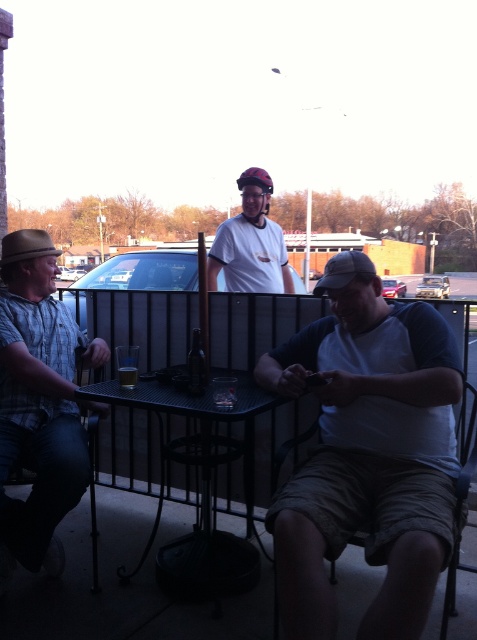
You are trying to determine if the white cotton shirt at center can fully cover the matte white helmet at center. Based on their sizes, is this possible?

The white cotton shirt at center is wider than the matte white helmet at center, so it is possible for the white cotton shirt at center to fully cover the matte white helmet at center.

In the scene shown: You are a photographer trying to capture a candid shot of the white cotton shirt at center and the matte white helmet at center. Your camera has a maximum focus range of 1.5 meters. Can you take a photo that includes both subjects clearly in focus?

The white cotton shirt at center is 1.45 meters from the matte white helmet at center, which is within the camera maximum focus range of 1.5 meters. Yes, you can take a photo that includes both subjects clearly in focus.